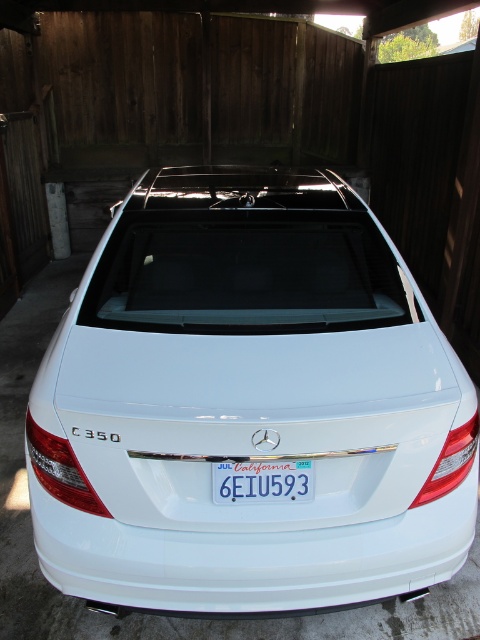
Who is higher up, white glossy sedan at center or blue metallic license plate at center?

white glossy sedan at center

Image resolution: width=480 pixels, height=640 pixels. Describe the element at coordinates (249, 404) in the screenshot. I see `white glossy sedan at center` at that location.

Between point (148, 275) and point (294, 486), which one is positioned behind?

Point (148, 275)

You are a GUI agent. You are given a task and a screenshot of the screen. Output one action in this format:
    pyautogui.click(x=<x>, y=<y>)
    Task: Click on the white glossy sedan at center
    This screenshot has height=640, width=480.
    Given the screenshot: What is the action you would take?
    pyautogui.click(x=249, y=404)